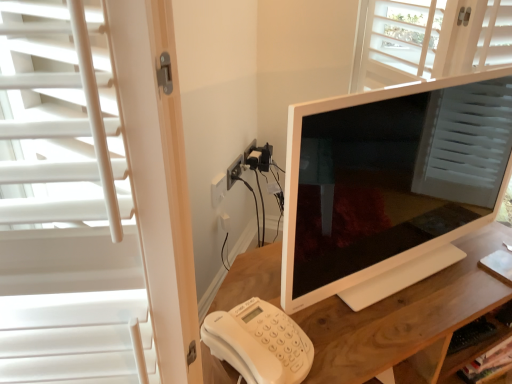
Question: Considering the positions of white glossy monitor at center and wooden shelf at lower right in the image, is white glossy monitor at center taller or shorter than wooden shelf at lower right?

Choices:
 (A) short
 (B) tall

Answer: (B)

Question: Is point (489, 196) positioned closer to the camera than point (464, 359)?

Choices:
 (A) closer
 (B) farther

Answer: (B)

Question: Which is nearer to the wooden shelf at lower right?

Choices:
 (A) wooden desk at center
 (B) white glossy monitor at center
 (C) white plastic phone at lower left
 (D) white plastic outlet at center

Answer: (A)

Question: Based on their relative distances, which object is farther from the white plastic outlet at center?

Choices:
 (A) white glossy monitor at center
 (B) wooden shelf at lower right
 (C) white plastic phone at lower left
 (D) wooden desk at center

Answer: (B)